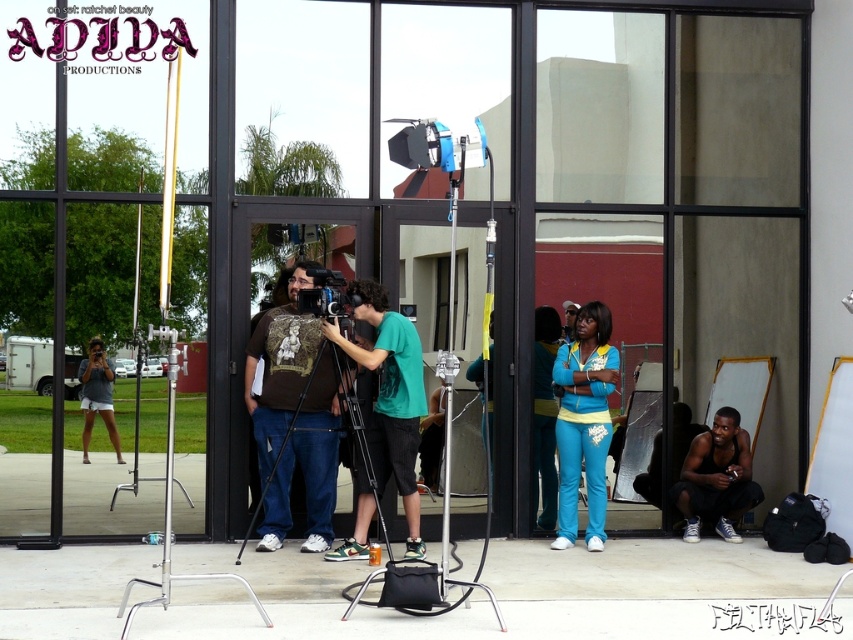
Which of these two, black matte tripod at center or turquoise fabric pants at right, stands shorter?

Standing shorter between the two is black matte tripod at center.

Between point (283, 480) and point (614, 348), which one is positioned in front?

Point (283, 480) is in front.

Measure the distance between black matte tripod at center and camera.

black matte tripod at center and camera are 30.16 feet apart.

Locate an element on the screen. The image size is (853, 640). black matte tripod at center is located at coordinates (296, 419).

Which is below, black metal tripod at center or matte black video camera at center?

black metal tripod at center

Looking at this image, who is higher up, black metal tripod at center or matte black video camera at center?

Positioned higher is matte black video camera at center.

Is point (440, 584) positioned after point (335, 301)?

No, (440, 584) is in front of (335, 301).

At what (x,y) coordinates should I click in order to perform the action: click on black metal tripod at center. Please return your answer as a coordinate pair (x, y). Looking at the image, I should click on (450, 497).

Who is positioned more to the right, turquoise fabric pants at right or black tank top at lower right?

From the viewer's perspective, black tank top at lower right appears more on the right side.

Is point (572, 352) farther from camera compared to point (737, 467)?

No, it is in front of (737, 467).

Identify the location of turquoise fabric pants at right. The height and width of the screenshot is (640, 853). (584, 422).